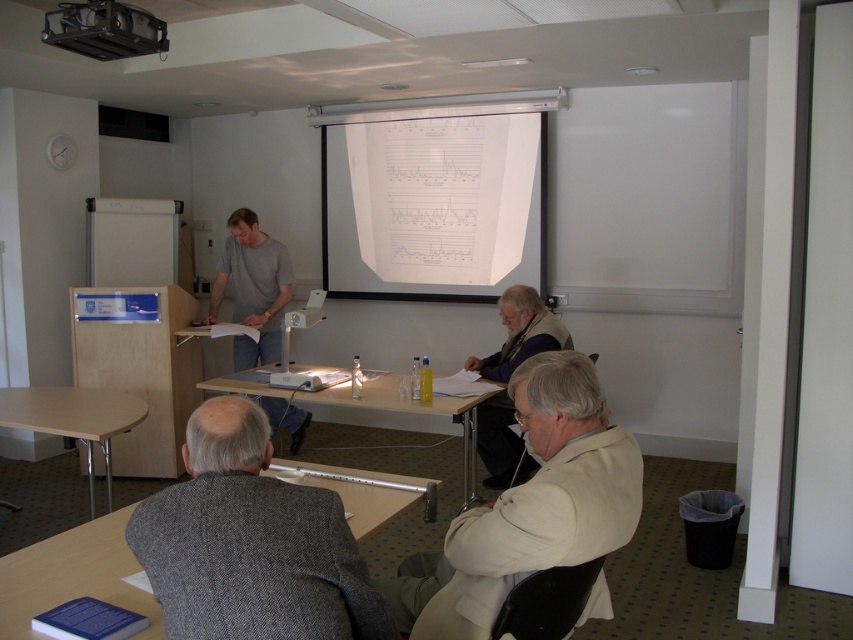
Question: Can you confirm if wooden table at lower center is positioned below light beige sweater at center?

Choices:
 (A) yes
 (B) no

Answer: (A)

Question: Which point is closer to the camera?

Choices:
 (A) (137, 42)
 (B) (531, 424)

Answer: (B)

Question: Does wooden table at lower center appear on the left side of wooden table at center?

Choices:
 (A) yes
 (B) no

Answer: (A)

Question: Is gray cotton shirt at center thinner than light beige sweater at center?

Choices:
 (A) yes
 (B) no

Answer: (A)

Question: Which object is farther from the camera taking this photo?

Choices:
 (A) light beige sweater at center
 (B) metallic projector at upper left
 (C) light brown wooden table at lower left

Answer: (A)

Question: Which point is farther from the camera taking this photo?

Choices:
 (A) (265, 348)
 (B) (141, 410)

Answer: (A)